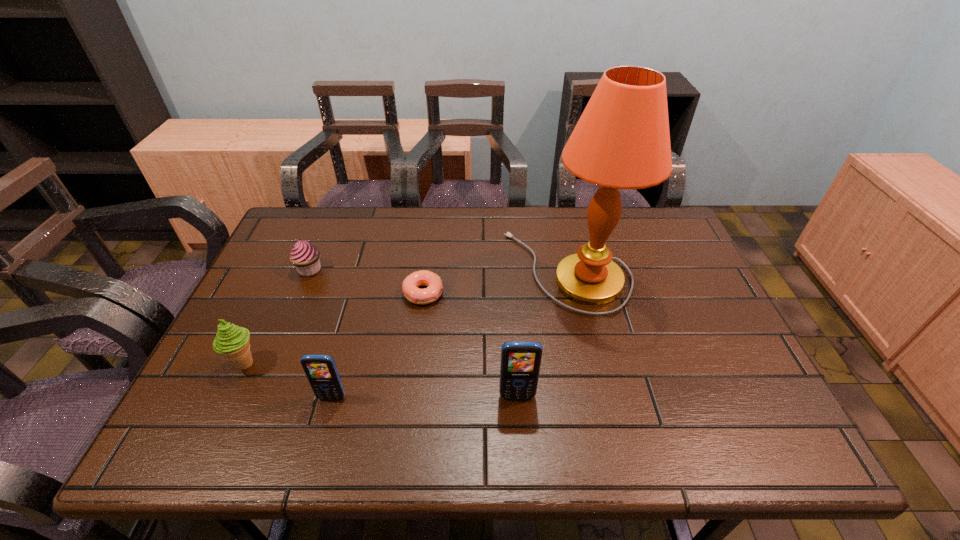
Locate an element on the screen. The height and width of the screenshot is (540, 960). free space at the near left corner of the desktop is located at coordinates (201, 392).

The image size is (960, 540). What are the coordinates of `empty location between the lamp and the cupcake` in the screenshot? It's located at (439, 270).

Where is `free spot between the tallest object and the cupcake`? free spot between the tallest object and the cupcake is located at coordinates (439, 270).

What are the coordinates of `free area in between the lamp and the shortest object` in the screenshot? It's located at (495, 282).

In order to click on unoccupied position between the doughnut and the tallest object in this screenshot , I will do `click(495, 282)`.

Locate an element on the screen. vacant area that lies between the third nearest object and the left cellular telephone is located at coordinates (288, 380).

Find the location of a particular element. empty space between the lamp and the right cellular telephone is located at coordinates (542, 334).

Find the location of a particular element. This screenshot has height=540, width=960. vacant space in between the right cellular telephone and the icecream is located at coordinates (381, 380).

You are a GUI agent. You are given a task and a screenshot of the screen. Output one action in this format:
    pyautogui.click(x=<x>, y=<y>)
    Task: Click on the free space that is in between the third object from left to right and the doughnut
    
    Given the screenshot: What is the action you would take?
    pyautogui.click(x=377, y=345)

Where is `empty space that is in between the taller cellular telephone and the icecream`? This screenshot has width=960, height=540. empty space that is in between the taller cellular telephone and the icecream is located at coordinates (381, 380).